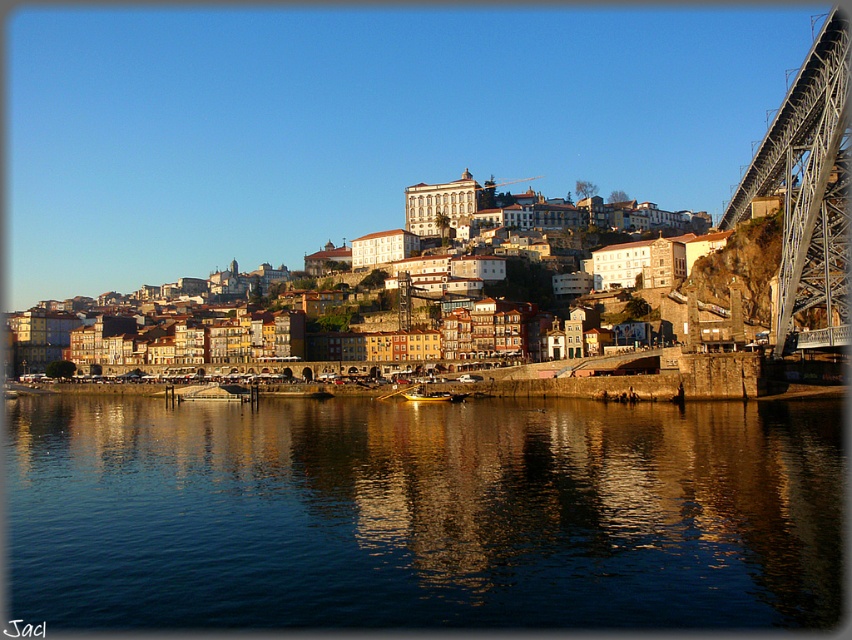
In the scene shown: You are a tourist standing at the riverside and want to take a photo that includes both the dark blue water at lower center and the multicolored stone buildings at center. Considering their sizes, which object should you frame closer to the edge of the photo to ensure both are visible?

Since the dark blue water at lower center is smaller in size compared to the multicolored stone buildings at center, you should frame the dark blue water at lower center closer to the edge of the photo to ensure both objects are visible while maintaining their proportions.

You are a tourist standing at the riverside and want to take a photo that includes both the dark blue water at lower center and the metallic steel bridge at right. Since you have a camera with a fixed focal length, you need to know which object takes up more space in the frame. Which one is bigger?

The dark blue water at lower center is larger in size compared to the metallic steel bridge at right, so it will take up more space in the photo.